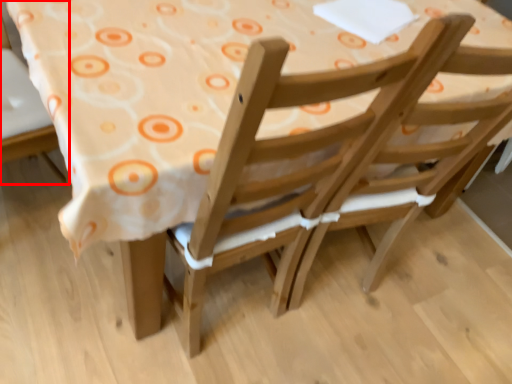
Question: From the image's perspective, considering the relative positions of chair (annotated by the red box) and chair in the image provided, where is chair (annotated by the red box) located with respect to the staircase?

Choices:
 (A) below
 (B) above

Answer: (B)